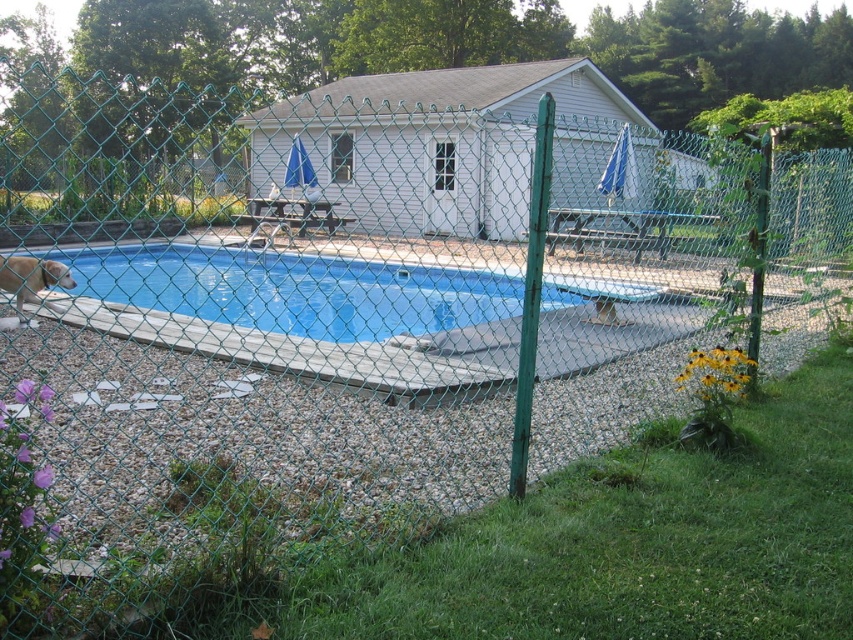
You are standing at the edge of the swimming pool and see the blue vinyl liner at left and the light brown fur at lower left. Which object is positioned to the right of the other?

The blue vinyl liner at left is positioned to the right of the light brown fur at lower left.

You are a guest at a backyard party and see the blue vinyl liner at left and the light brown fur at lower left. Which object is covering the other one?

The blue vinyl liner at left is positioned over the light brown fur at lower left, so it is covering it.

Consider the image. You are planning to place a small potted plant between the blue vinyl liner at left and the light brown fur at lower left. Which object should the plant be placed closer to if you want it to be at a lower elevation?

The plant should be placed closer to the blue vinyl liner at left because it has a lesser height compared to the light brown fur at lower left, so the area near the blue vinyl liner at left is lower in elevation.